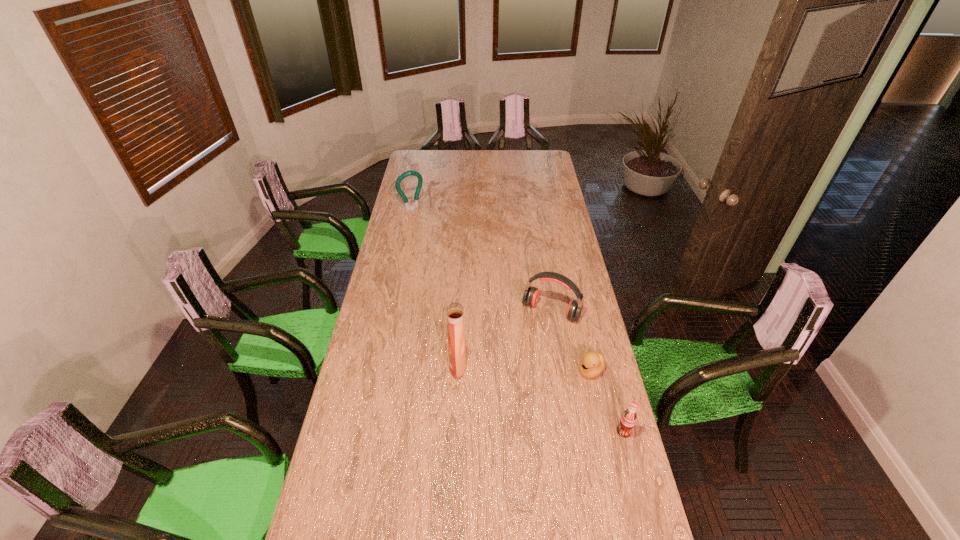
The width and height of the screenshot is (960, 540). I want to click on free space on the desktop that is between the tallest object and the nearest object and is positioned on the ear cups of the second farthest object, so click(x=512, y=387).

I want to click on vacant space on the desktop that is between the detergent and the nearest object and is positioned facing forward on the shortest object, so click(x=555, y=404).

Where is `vacant space on the desktop that is between the second object from left to right and the second shortest object and is positioned at the jaws of the bottle opener`? The height and width of the screenshot is (540, 960). vacant space on the desktop that is between the second object from left to right and the second shortest object and is positioned at the jaws of the bottle opener is located at coordinates (552, 402).